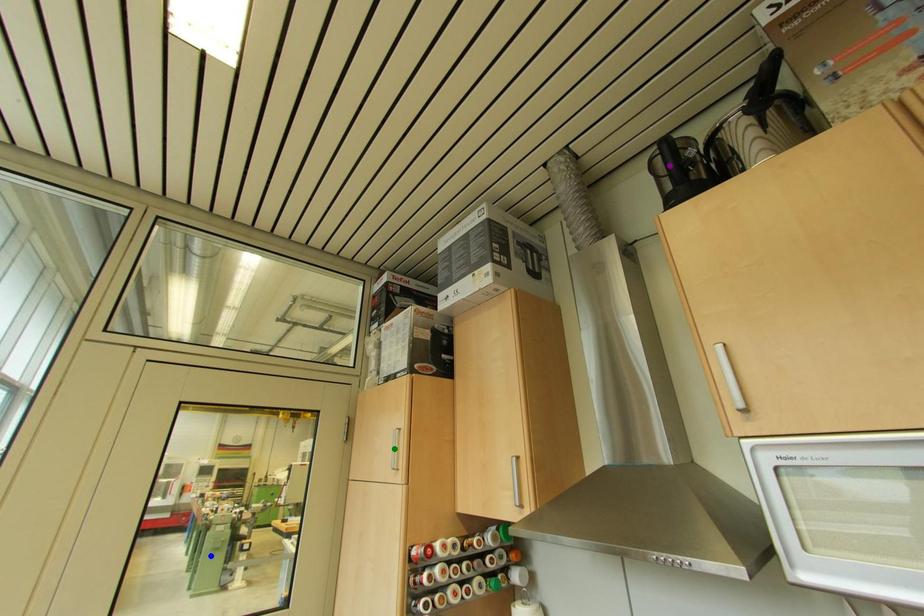
Order these from nearest to farthest:
green point | blue point | purple point

purple point → green point → blue point